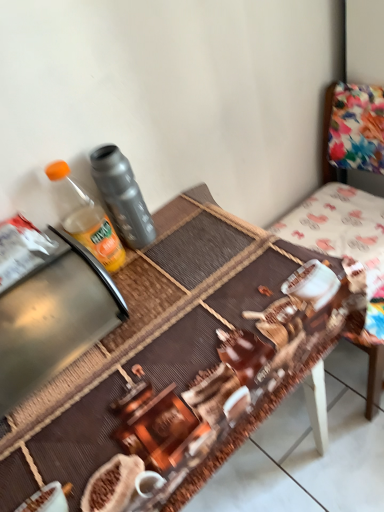
Question: From the image's perspective, is matte gray thermos at left, the 2th bottle when ordered from left to right, below brown woven mat at center?

Choices:
 (A) yes
 (B) no

Answer: (B)

Question: Can you confirm if matte gray thermos at left, the 1th bottle viewed from the right, is shorter than brown woven mat at center?

Choices:
 (A) no
 (B) yes

Answer: (B)

Question: Would you say matte gray thermos at left, the 1th bottle viewed from the right, contains brown woven mat at center?

Choices:
 (A) no
 (B) yes

Answer: (A)

Question: Does matte gray thermos at left, the 2th bottle when ordered from left to right, have a greater width compared to brown woven mat at center?

Choices:
 (A) no
 (B) yes

Answer: (A)

Question: From a real-world perspective, is matte gray thermos at left, the 1th bottle viewed from the right, on top of brown woven mat at center?

Choices:
 (A) no
 (B) yes

Answer: (B)

Question: Is matte gray thermos at left, the 2th bottle when ordered from left to right, thinner than brown woven mat at center?

Choices:
 (A) no
 (B) yes

Answer: (B)

Question: Considering the relative sizes of metallic stainless steel appliance at left and matte gray thermos at left, the 1th bottle viewed from the right, in the image provided, is metallic stainless steel appliance at left thinner than matte gray thermos at left, the 1th bottle viewed from the right,?

Choices:
 (A) no
 (B) yes

Answer: (A)

Question: Is matte gray thermos at left, the 1th bottle viewed from the right, located within metallic stainless steel appliance at left?

Choices:
 (A) yes
 (B) no

Answer: (B)

Question: Would you consider metallic stainless steel appliance at left to be distant from matte gray thermos at left, the 2th bottle when ordered from left to right?

Choices:
 (A) yes
 (B) no

Answer: (B)

Question: Does metallic stainless steel appliance at left have a smaller size compared to matte gray thermos at left, the 2th bottle when ordered from left to right?

Choices:
 (A) no
 (B) yes

Answer: (A)

Question: From the image's perspective, would you say metallic stainless steel appliance at left is shown under matte gray thermos at left, the 1th bottle viewed from the right?

Choices:
 (A) yes
 (B) no

Answer: (A)

Question: Is metallic stainless steel appliance at left facing away from matte gray thermos at left, the 2th bottle when ordered from left to right?

Choices:
 (A) no
 (B) yes

Answer: (A)

Question: Is translucent plastic bottle at upper left, acting as the 1th bottle starting from the left, further to camera compared to metallic stainless steel appliance at left?

Choices:
 (A) no
 (B) yes

Answer: (B)